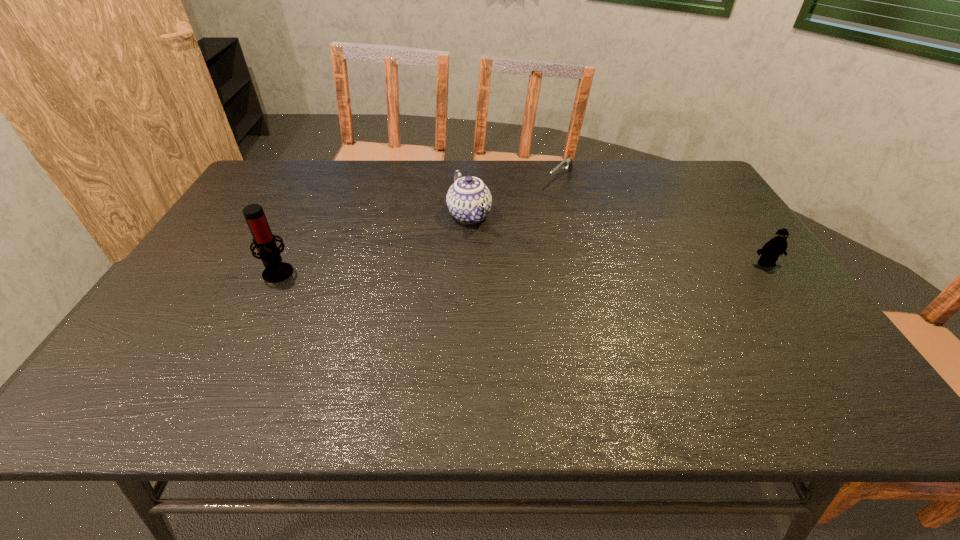
Where is `the leftmost object`? The height and width of the screenshot is (540, 960). the leftmost object is located at coordinates (276, 271).

The image size is (960, 540). I want to click on the tallest object, so click(276, 271).

Find the location of a particular element. This screenshot has height=540, width=960. the rightmost object is located at coordinates (770, 252).

Where is `the second shortest object`? This screenshot has width=960, height=540. the second shortest object is located at coordinates (770, 252).

I want to click on the third nearest object, so click(x=469, y=200).

Locate an element on the screen. This screenshot has width=960, height=540. the second object from left to right is located at coordinates (469, 200).

This screenshot has height=540, width=960. I want to click on the farthest object, so click(567, 162).

You are a GUI agent. You are given a task and a screenshot of the screen. Output one action in this format:
    pyautogui.click(x=<x>, y=<y>)
    Task: Click on the pistol
    The width and height of the screenshot is (960, 540).
    Given the screenshot: What is the action you would take?
    pyautogui.click(x=567, y=162)

Locate an element on the screen. The width and height of the screenshot is (960, 540). free space located 0.090m on the front of the leftmost object is located at coordinates (258, 309).

Locate an element on the screen. This screenshot has width=960, height=540. vacant region located on the face of the Lego is located at coordinates (829, 353).